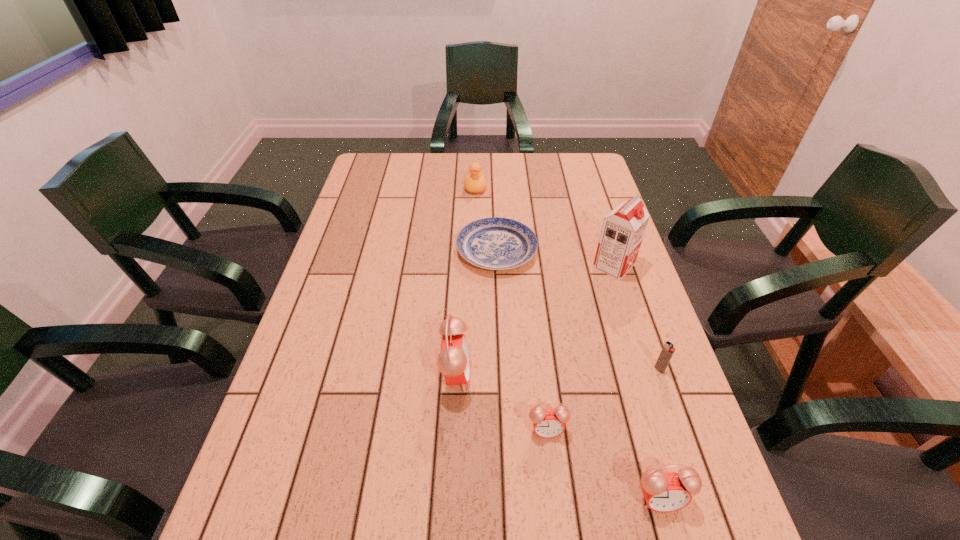
I want to click on free space between the second farthest alarm clock and the leftmost alarm clock, so point(501,402).

Find the location of a particular element. unoccupied area between the tallest object and the shortest object is located at coordinates (555, 258).

Where is `empty location between the shortest object and the second tallest object`? Image resolution: width=960 pixels, height=540 pixels. empty location between the shortest object and the second tallest object is located at coordinates pyautogui.click(x=476, y=313).

The image size is (960, 540). I want to click on free space between the igniter and the tallest alarm clock, so click(558, 372).

Find the location of a particular element. free space between the leftmost alarm clock and the second farthest alarm clock is located at coordinates (501, 402).

Locate an element on the screen. The image size is (960, 540). empty space between the sixth shortest object and the second alarm clock from left to right is located at coordinates (501, 402).

This screenshot has width=960, height=540. In order to click on object that stands as the fourth closest to the second alarm clock from right to left in this screenshot , I will do `click(495, 243)`.

At what (x,y) coordinates should I click in order to perform the action: click on object that is the fifth closest one to the second tallest object. Please return your answer as a coordinate pair (x, y). The image size is (960, 540). Looking at the image, I should click on pyautogui.click(x=668, y=350).

You are a GUI agent. You are given a task and a screenshot of the screen. Output one action in this format:
    pyautogui.click(x=<x>, y=<y>)
    Task: Click on the alarm clock that can be found as the third closest to the shortest object
    The image size is (960, 540).
    Given the screenshot: What is the action you would take?
    pyautogui.click(x=664, y=492)

Identify which alarm clock is the nearest to the duck. Please provide its 2D coordinates. Your answer should be formatted as a tuple, i.e. [(x, y)], where the tuple contains the x and y coordinates of a point satisfying the conditions above.

[(453, 362)]